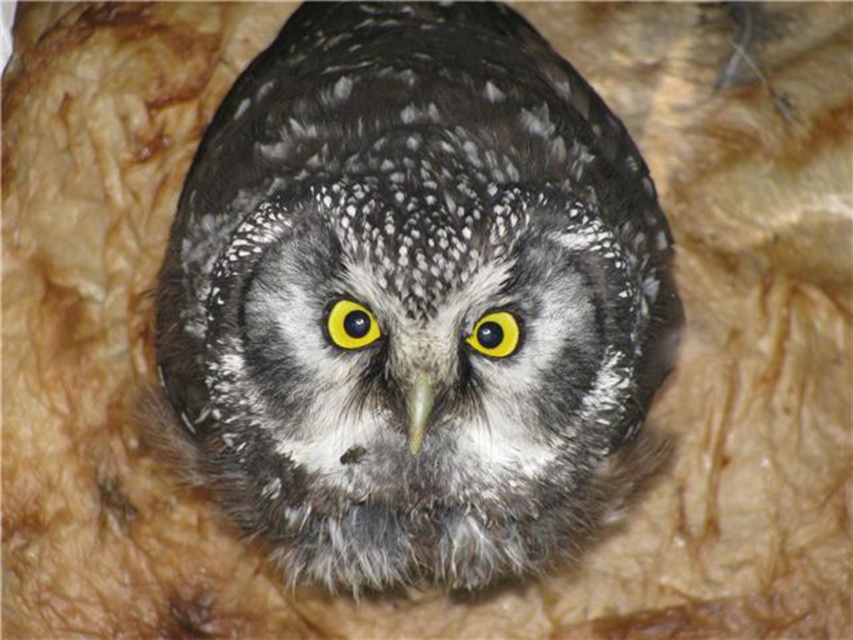
Does speckled feathered owl at center have a smaller size compared to green matte beak at center?

Actually, speckled feathered owl at center might be larger than green matte beak at center.

Is speckled feathered owl at center wider than green matte beak at center?

Yes.

Is point (376, 17) more distant than point (416, 419)?

Yes, point (376, 17) is farther from viewer.

You are a GUI agent. You are given a task and a screenshot of the screen. Output one action in this format:
    pyautogui.click(x=<x>, y=<y>)
    Task: Click on the speckled feathered owl at center
    This screenshot has width=853, height=640.
    Given the screenshot: What is the action you would take?
    pyautogui.click(x=415, y=296)

Is yellow shiny eye at center shorter than yellow matte eye at center?

No, yellow shiny eye at center is not shorter than yellow matte eye at center.

How far apart are yellow shiny eye at center and yellow matte eye at center?

yellow shiny eye at center is 4.83 inches from yellow matte eye at center.

Between point (363, 312) and point (492, 339), which one is positioned behind?

Point (492, 339)

Image resolution: width=853 pixels, height=640 pixels. I want to click on yellow shiny eye at center, so click(x=350, y=324).

Is yellow matte eye at center to the left of green matte beak at center from the viewer's perspective?

In fact, yellow matte eye at center is to the right of green matte beak at center.

Between yellow matte eye at center and green matte beak at center, which one appears on the left side from the viewer's perspective?

green matte beak at center

At what (x,y) coordinates should I click in order to perform the action: click on yellow matte eye at center. Please return your answer as a coordinate pair (x, y). This screenshot has width=853, height=640. Looking at the image, I should click on (495, 333).